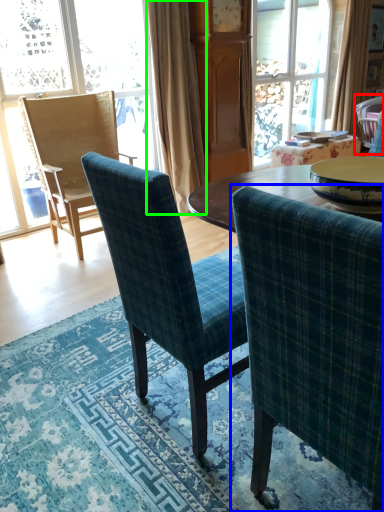
Question: Which is farther away from chair (highlighted by a red box)? chair (highlighted by a blue box) or curtain (highlighted by a green box)?

Choices:
 (A) chair
 (B) curtain

Answer: (A)